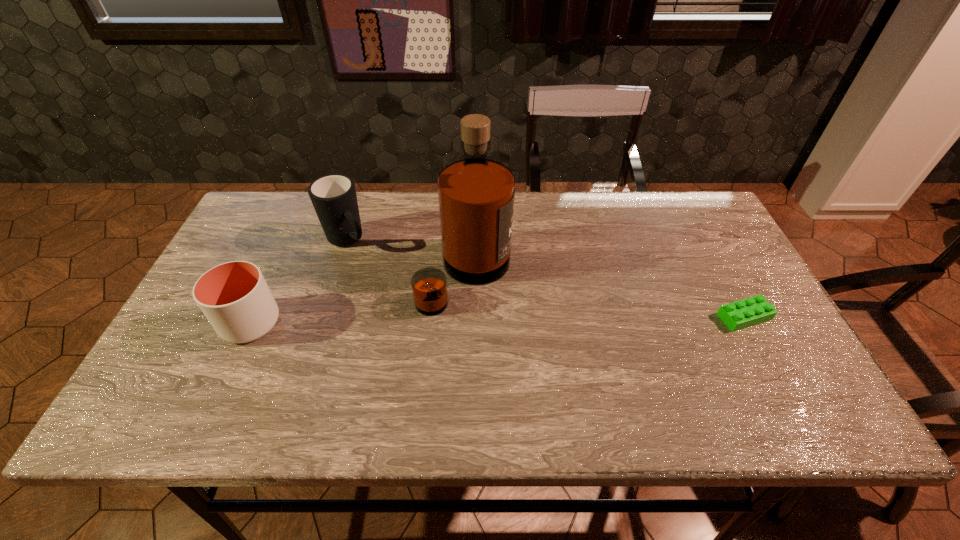
Locate an element on the screen. This screenshot has width=960, height=540. cup is located at coordinates (234, 296).

Where is `the leftmost object`? Image resolution: width=960 pixels, height=540 pixels. the leftmost object is located at coordinates (234, 296).

Where is `the shortest object`? the shortest object is located at coordinates (751, 311).

At what (x,y) coordinates should I click in order to perform the action: click on Lego. Please return your answer as a coordinate pair (x, y). This screenshot has height=540, width=960. Looking at the image, I should click on (751, 311).

Identify the location of the third object from right to left. (334, 198).

Where is `mug`? mug is located at coordinates (334, 198).

Locate an element on the screen. This screenshot has width=960, height=540. the second object from right to left is located at coordinates (476, 194).

This screenshot has width=960, height=540. What are the coordinates of `liquor` in the screenshot? It's located at (476, 194).

Where is `free space located on the right of the cup`? free space located on the right of the cup is located at coordinates (316, 323).

In order to click on vacant space located on the left of the shortest object in this screenshot , I will do `click(634, 317)`.